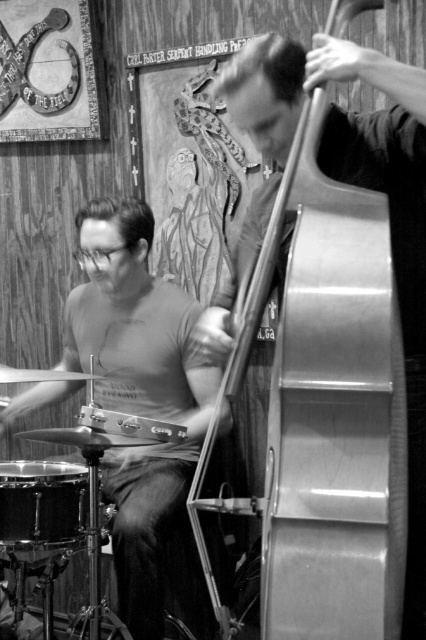
Question: Does matte black drum set at left have a lesser width compared to metallic silver cello at right?

Choices:
 (A) no
 (B) yes

Answer: (A)

Question: Estimate the real-world distances between objects in this image. Which object is farther from the black drum at lower left?

Choices:
 (A) matte black drum set at left
 (B) metallic silver cello at right

Answer: (B)

Question: Which object appears closest to the camera in this image?

Choices:
 (A) metallic silver cello at right
 (B) black drum at lower left
 (C) matte black drum set at left

Answer: (A)

Question: Is matte black drum set at left to the left of metallic silver cello at right from the viewer's perspective?

Choices:
 (A) yes
 (B) no

Answer: (A)

Question: Is matte black drum set at left bigger than black drum at lower left?

Choices:
 (A) yes
 (B) no

Answer: (A)

Question: Estimate the real-world distances between objects in this image. Which object is farther from the matte black drum set at left?

Choices:
 (A) black drum at lower left
 (B) metallic silver cello at right

Answer: (B)